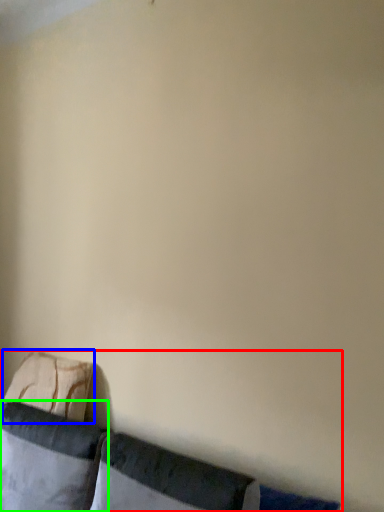
Question: Estimate the real-world distances between objects in this image. Which object is closer to furniture (highlighted by a red box), pillow (highlighted by a blue box) or pillow (highlighted by a green box)?

Choices:
 (A) pillow
 (B) pillow

Answer: (B)